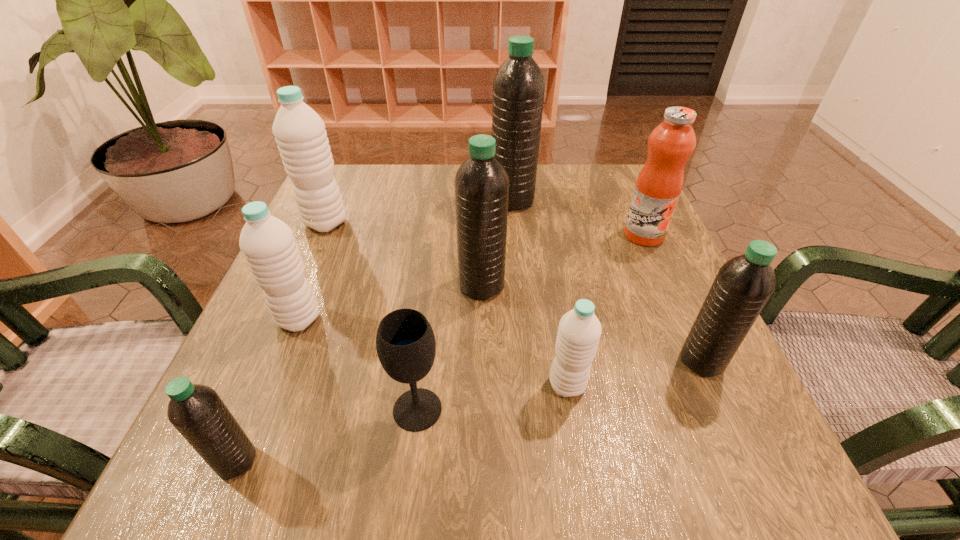
The image size is (960, 540). I want to click on empty location between the nearest white water bottle and the wineglass, so click(x=492, y=397).

You are a GUI agent. You are given a task and a screenshot of the screen. Output one action in this format:
    pyautogui.click(x=<x>, y=<y>)
    Task: Click on the object that is the third nearest to the biggest white water bottle
    
    Given the screenshot: What is the action you would take?
    pyautogui.click(x=518, y=88)

Choose which object is the seventh nearest neighbor to the third nearest black water bottle. Please provide its 2D coordinates. Your answer should be formatted as a tuple, i.e. [(x, y)], where the tuple contains the x and y coordinates of a point satisfying the conditions above.

[(743, 285)]

I want to click on water bottle that is the seventh closest to the fruit juice, so click(x=198, y=413).

This screenshot has width=960, height=540. Identify the location of water bottle that is the sixth closest to the biggest white water bottle. (743, 285).

The image size is (960, 540). I want to click on black water bottle that stands as the second closest to the fruit juice, so click(x=743, y=285).

Choose which black water bottle is the third nearest neighbor to the second farthest black water bottle. Please provide its 2D coordinates. Your answer should be formatted as a tuple, i.e. [(x, y)], where the tuple contains the x and y coordinates of a point satisfying the conditions above.

[(198, 413)]

This screenshot has width=960, height=540. Identify the location of white water bottle that stands as the second closest to the biggest white water bottle. (579, 330).

I want to click on white water bottle that can be found as the second closest to the wineglass, so click(x=268, y=244).

Identify the location of vacant position in the image that satisfies the following two spatial constraints: 1. on the back side of the farthest black water bottle; 2. on the right side of the biggest white water bottle. (336, 200).